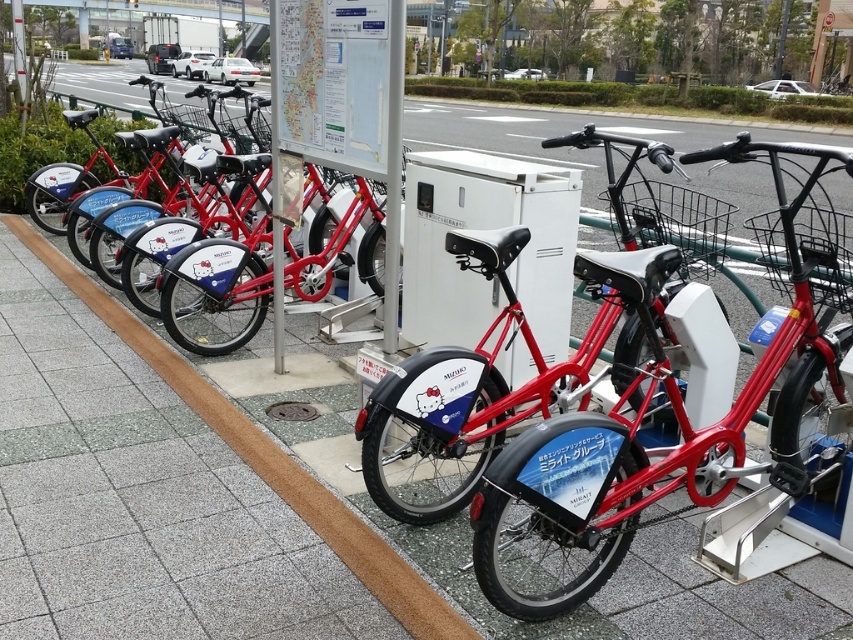
Does matte red bicycle at center appear on the left side of white paper at upper center?

No, matte red bicycle at center is not to the left of white paper at upper center.

Who is more distant from viewer, (471, 419) or (392, 0)?

Point (392, 0)

I want to click on matte red bicycle at center, so click(486, 376).

The image size is (853, 640). Find the location of `matte red bicycle at center`. matte red bicycle at center is located at coordinates (486, 376).

How distant is matte red bicycle at center from gray concrete curb at center?

matte red bicycle at center is 30.33 inches from gray concrete curb at center.

What do you see at coordinates (486, 376) in the screenshot? I see `matte red bicycle at center` at bounding box center [486, 376].

Between point (401, 397) and point (149, 339), which one is positioned in front?

Point (401, 397)

Identify the location of matte red bicycle at center. (486, 376).

Who is positioned more to the right, metallic red bicycle at center or matte black bicycle at center?

metallic red bicycle at center

Which is more to the left, metallic red bicycle at center or matte black bicycle at center?

Positioned to the left is matte black bicycle at center.

What do you see at coordinates (670, 416) in the screenshot?
I see `metallic red bicycle at center` at bounding box center [670, 416].

I want to click on metallic red bicycle at center, so click(670, 416).